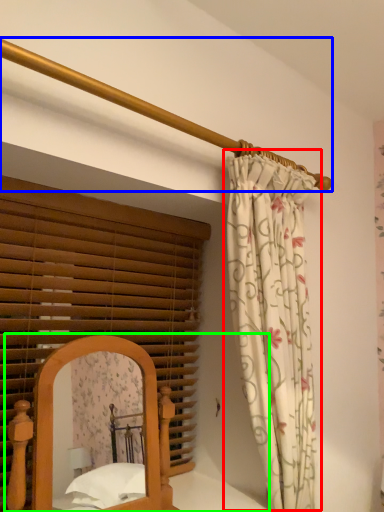
Question: Which object is the farthest from curtain (highlighted by a red box)? Choose among these: balustrade (highlighted by a blue box) or bed (highlighted by a green box).

Choices:
 (A) balustrade
 (B) bed

Answer: (B)